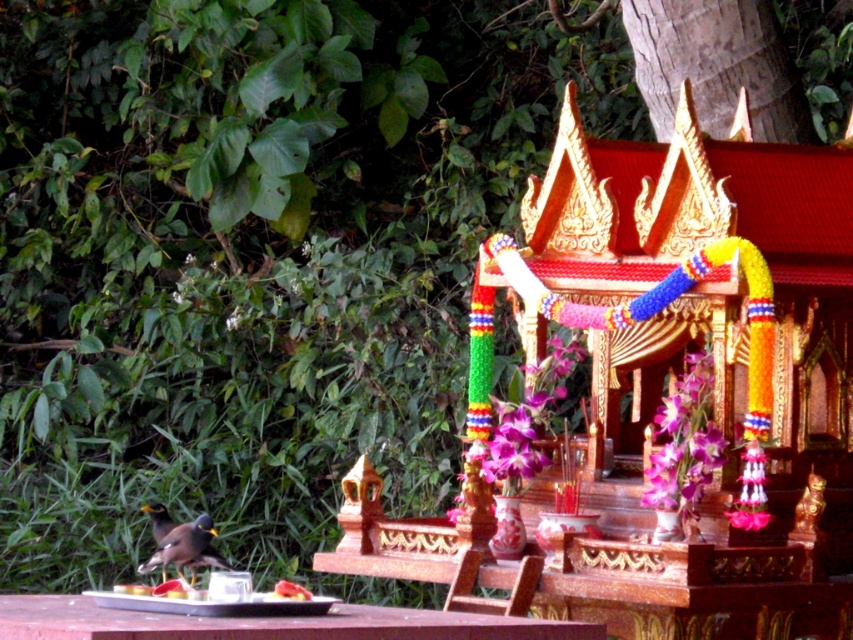
Is point (20, 624) positioned behind point (154, 554)?

No, (20, 624) is in front of (154, 554).

Between point (155, 612) and point (178, 570), which one is positioned behind?

The point (178, 570) is behind.

Locate an element on the screen. The height and width of the screenshot is (640, 853). wooden table at center is located at coordinates (267, 624).

Does wooden table at center have a smaller size compared to smooth red plate at lower center?

Actually, wooden table at center might be larger than smooth red plate at lower center.

Is wooden table at center positioned behind smooth red plate at lower center?

No, wooden table at center is closer to the viewer.

Which is behind, point (323, 621) or point (299, 596)?

The point (299, 596) is behind.

Identify the location of wooden table at center. (267, 624).

Is the position of shiny brown bird at lower left more distant than that of smooth red plate at lower center?

Yes, shiny brown bird at lower left is further from the viewer.

Which of these two, shiny brown bird at lower left or smooth red plate at lower center, stands taller?

shiny brown bird at lower left is taller.

Does point (180, 547) come farther from viewer compared to point (293, 586)?

Yes, point (180, 547) is farther from viewer.

Where is `shiny brown bird at lower left`? The image size is (853, 640). shiny brown bird at lower left is located at coordinates (180, 541).